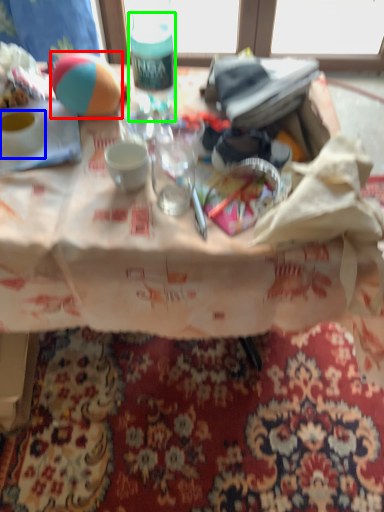
Question: Considering the real-world distances, which object is closest to ball (highlighted by a red box)? coffee cup (highlighted by a blue box) or bottle (highlighted by a green box).

Choices:
 (A) coffee cup
 (B) bottle

Answer: (B)